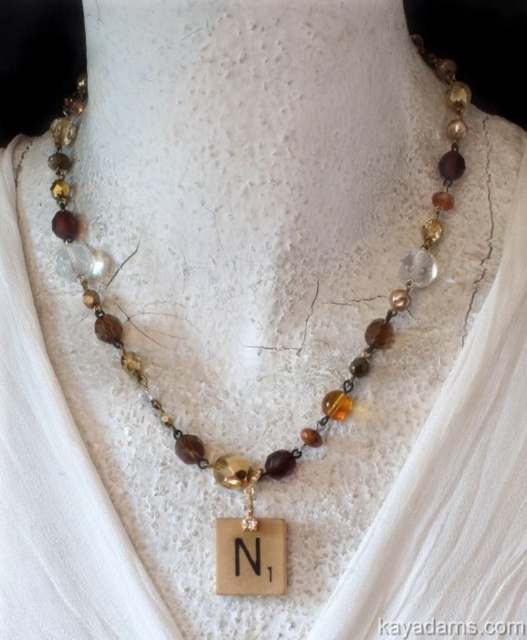
Can you confirm if translucent glass beads at center is positioned below wooden square at center?

No.

Between translucent glass beads at center and wooden square at center, which one appears on the right side from the viewer's perspective?

From the viewer's perspective, wooden square at center appears more on the right side.

This screenshot has height=640, width=527. What do you see at coordinates (325, 394) in the screenshot? I see `translucent glass beads at center` at bounding box center [325, 394].

The height and width of the screenshot is (640, 527). Find the location of `translucent glass beads at center`. translucent glass beads at center is located at coordinates (325, 394).